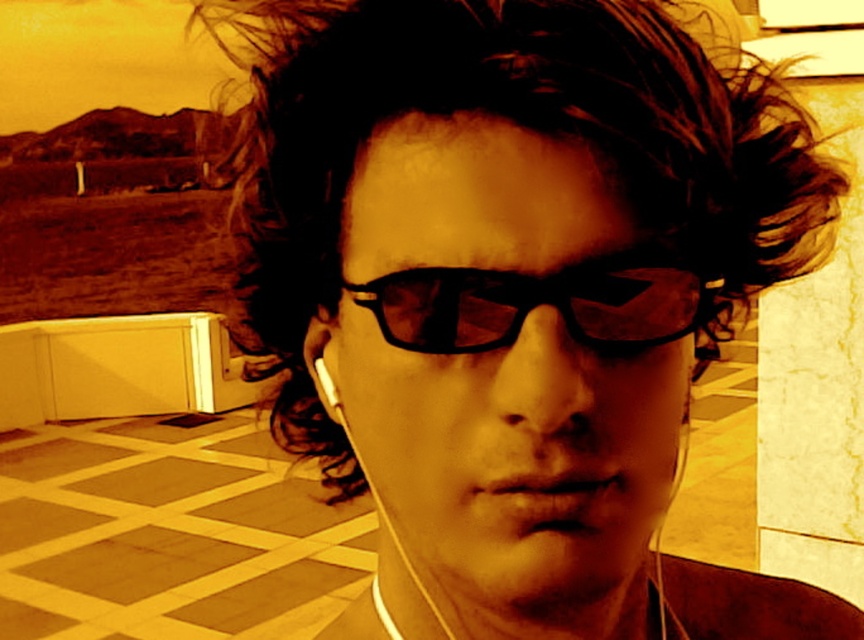
Question: Does black matte glasses at center appear on the right side of black matte earphone at center?

Choices:
 (A) yes
 (B) no

Answer: (A)

Question: Which point appears closest to the camera in this image?

Choices:
 (A) (297, 189)
 (B) (469, 282)

Answer: (B)

Question: Does dark brown curly hair at center have a larger size compared to black matte earphone at center?

Choices:
 (A) no
 (B) yes

Answer: (B)

Question: From the image, what is the correct spatial relationship of dark brown curly hair at center in relation to black matte glasses at center?

Choices:
 (A) left
 (B) right

Answer: (A)

Question: Which point is farther from the camera taking this photo?

Choices:
 (A) (612, 304)
 (B) (340, 410)

Answer: (B)

Question: Which object is positioned closest to the dark brown curly hair at center?

Choices:
 (A) black matte glasses at center
 (B) black matte earphone at center

Answer: (A)